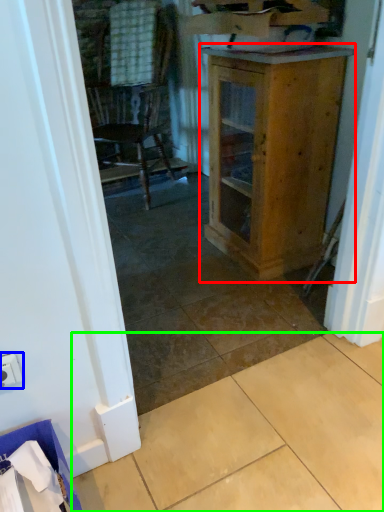
Question: Based on their relative distances, which object is farther from cabinetry (highlighted by a red box)? Choose from electric outlet (highlighted by a blue box) and tile (highlighted by a green box).

Choices:
 (A) electric outlet
 (B) tile

Answer: (A)